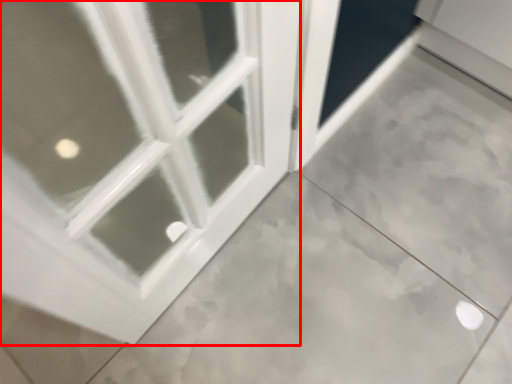
Question: In this image, where is window (annotated by the red box) located relative to screen door?

Choices:
 (A) left
 (B) right

Answer: (A)